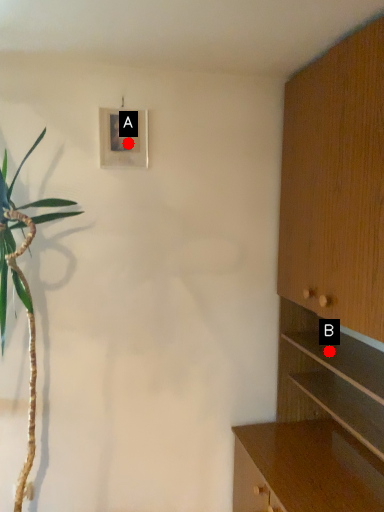
Question: Two points are circled on the image, labeled by A and B beside each circle. Which point is closer to the camera?

Choices:
 (A) A is closer
 (B) B is closer

Answer: (B)